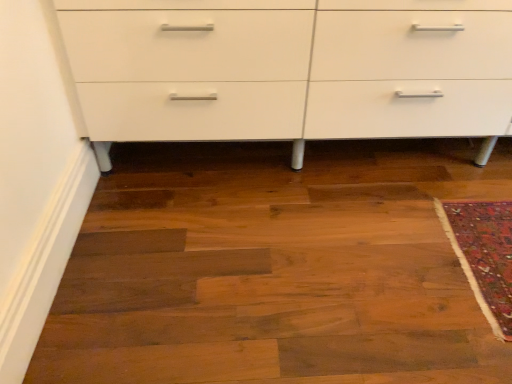
The width and height of the screenshot is (512, 384). Describe the element at coordinates (291, 69) in the screenshot. I see `white glossy chest of drawers at center` at that location.

This screenshot has height=384, width=512. In order to click on white glossy chest of drawers at center in this screenshot , I will do `click(291, 69)`.

At what (x,y) coordinates should I click in order to perform the action: click on white glossy chest of drawers at center. Please return your answer as a coordinate pair (x, y). Looking at the image, I should click on [291, 69].